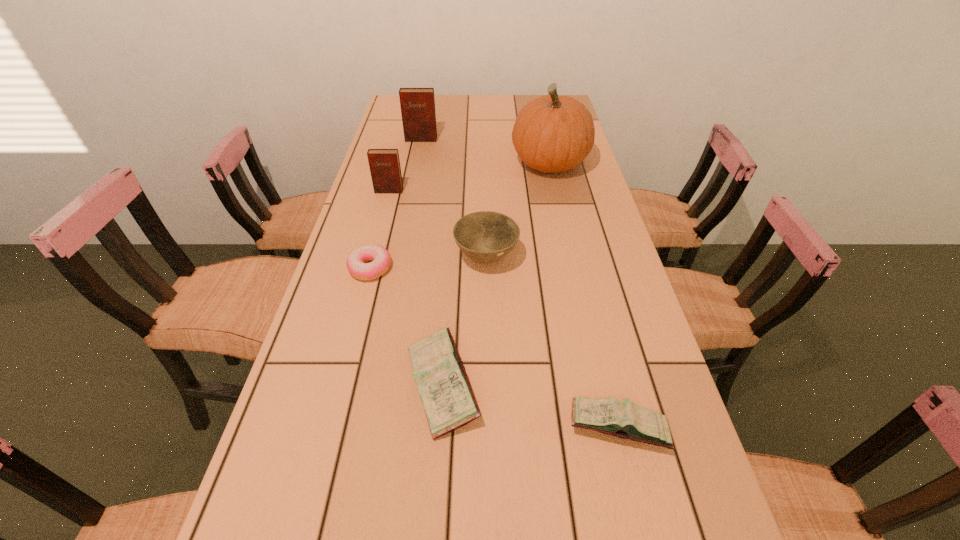
Where is `vacant area that lies between the bowl and the orange pumpkin`? This screenshot has width=960, height=540. vacant area that lies between the bowl and the orange pumpkin is located at coordinates (517, 211).

This screenshot has width=960, height=540. In order to click on empty space that is in between the second tallest diary and the pumpkin in this screenshot , I will do 469,178.

Where is `free space between the tallest object and the fourth shortest object`? free space between the tallest object and the fourth shortest object is located at coordinates (517, 211).

Find the location of a particular element. vacant space that's between the second diary from right to left and the shortest object is located at coordinates (406, 326).

Image resolution: width=960 pixels, height=540 pixels. I want to click on object that is the third nearest to the third farthest object, so click(417, 105).

Where is `object that stands as the closest to the smaller reddish-brown diary`? object that stands as the closest to the smaller reddish-brown diary is located at coordinates (486, 236).

Choose which diary is the third nearest neighbor to the second shortest object. Please provide its 2D coordinates. Your answer should be formatted as a tuple, i.e. [(x, y)], where the tuple contains the x and y coordinates of a point satisfying the conditions above.

[(417, 105)]

At what (x,y) coordinates should I click in order to perform the action: click on diary that is the second closest to the shortest diary. Please return your answer as a coordinate pair (x, y). Image resolution: width=960 pixels, height=540 pixels. Looking at the image, I should click on (384, 164).

Locate an element on the screen. The height and width of the screenshot is (540, 960). pink diary that is the second closest one to the smaller reddish-brown diary is located at coordinates (624, 419).

Where is `vacant space that satisfies the following two spatial constraints: 1. on the front cover of the second farthest diary; 2. on the right side of the third tallest diary`? The width and height of the screenshot is (960, 540). vacant space that satisfies the following two spatial constraints: 1. on the front cover of the second farthest diary; 2. on the right side of the third tallest diary is located at coordinates (337, 384).